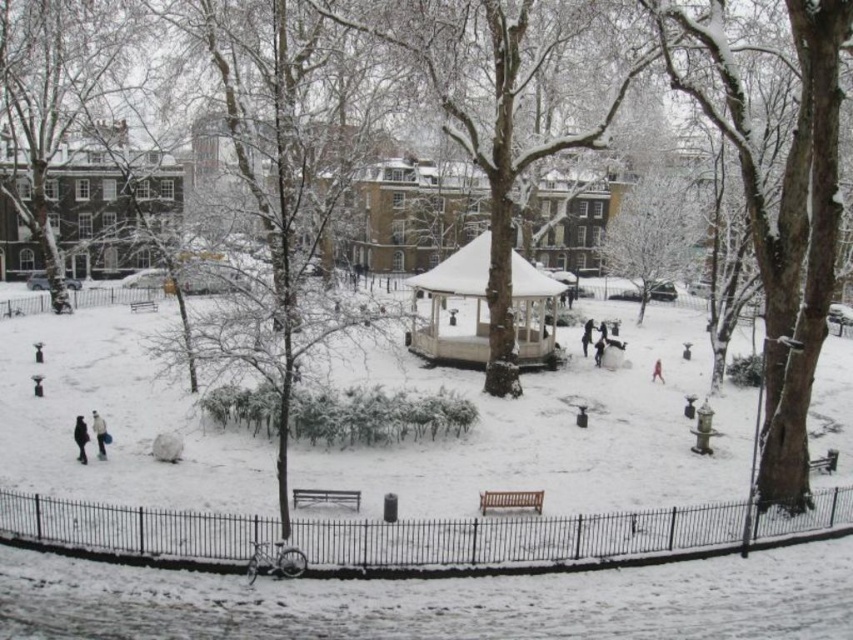
You are standing in the winter park and want to take a photo of the white wooden gazebo at center and the light brown leather jacket at lower left. Which object should you focus on first if you want to capture both in a single frame without moving the camera?

You should focus on the white wooden gazebo at center first because it is closer to you than the light brown leather jacket at lower left, so it will be in focus first, allowing both to be captured in the frame.

You are standing at the edge of the park and want to walk towards the white wooden gazebo at center. There is a black fabric coat at lower left on the path. Which object will you encounter first?

You will encounter the black fabric coat at lower left first because it is closer to you than the white wooden gazebo at center, which is further away.